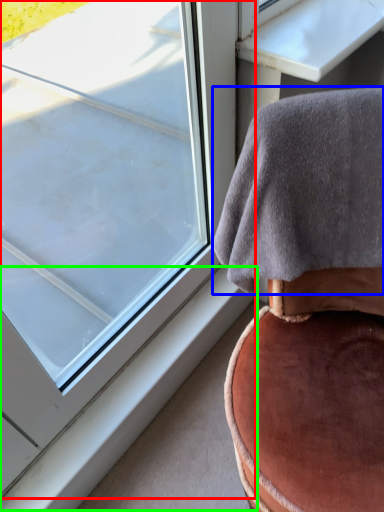
Question: Considering the real-world distances, which object is closest to window (highlighted by a red box)? blanket (highlighted by a blue box) or window sill (highlighted by a green box).

Choices:
 (A) blanket
 (B) window sill

Answer: (B)